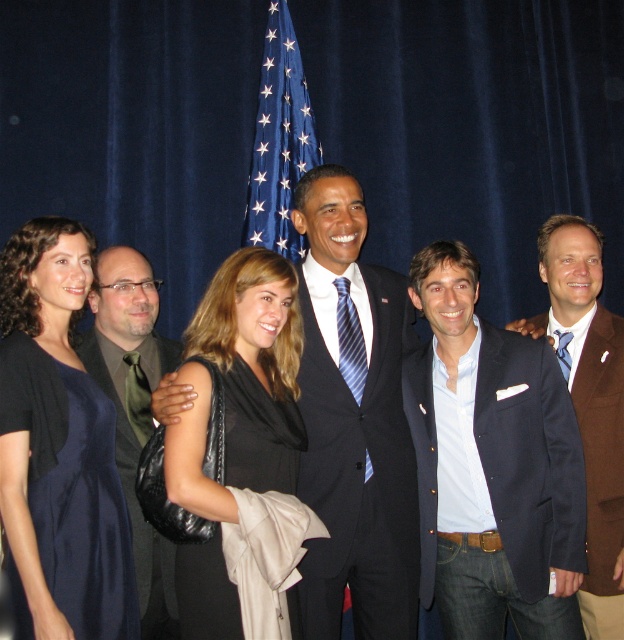
Question: Can you confirm if dark blue suit at center is positioned above blue fabric flag at upper center?

Choices:
 (A) no
 (B) yes

Answer: (A)

Question: Which point appears closest to the camera in this image?

Choices:
 (A) (232, 266)
 (B) (363, 273)

Answer: (A)

Question: Which point is closer to the camera?

Choices:
 (A) brown textured suit at right
 (B) blue fabric flag at upper center

Answer: (A)

Question: Among these objects, which one is nearest to the camera?

Choices:
 (A) green satin tie at left
 (B) blue textured suit at center
 (C) navy blue dress at left
 (D) blue fabric flag at upper center

Answer: (C)

Question: In this image, where is brown textured suit at right located relative to green satin tie at left?

Choices:
 (A) left
 (B) right

Answer: (B)

Question: Does navy blue dress at left have a smaller size compared to green satin tie at left?

Choices:
 (A) no
 (B) yes

Answer: (A)